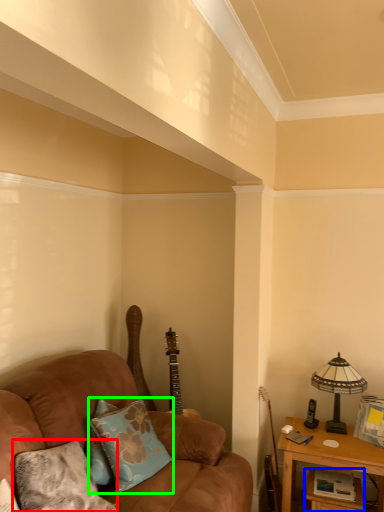
Question: Which object is the closest to the pillow (highlighted by a red box)? Choose among these: table (highlighted by a blue box) or pillow (highlighted by a green box).

Choices:
 (A) table
 (B) pillow

Answer: (B)